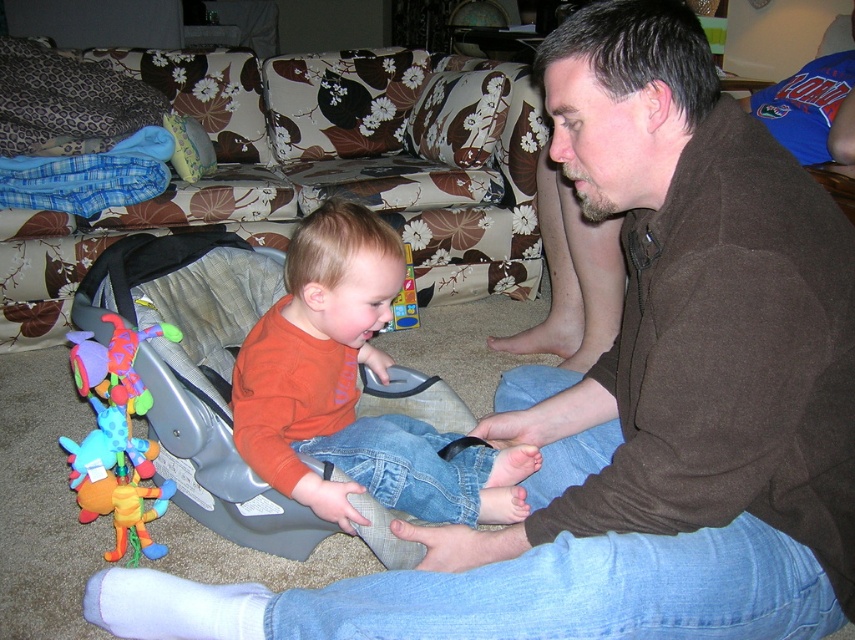
Can you confirm if orange soft shirt at center is smaller than plush multicolored baby rattle at left?

No, orange soft shirt at center is not smaller than plush multicolored baby rattle at left.

The width and height of the screenshot is (855, 640). What do you see at coordinates (352, 388) in the screenshot?
I see `orange soft shirt at center` at bounding box center [352, 388].

Does point (388, 422) lie in front of point (98, 348)?

No, it is behind (98, 348).

The height and width of the screenshot is (640, 855). I want to click on orange soft shirt at center, so click(352, 388).